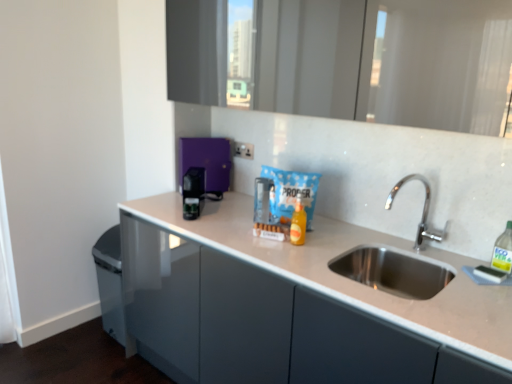
This screenshot has height=384, width=512. Identify the location of free spot in front of green translucent bottle at right, which is the first bottle from front to back. (500, 284).